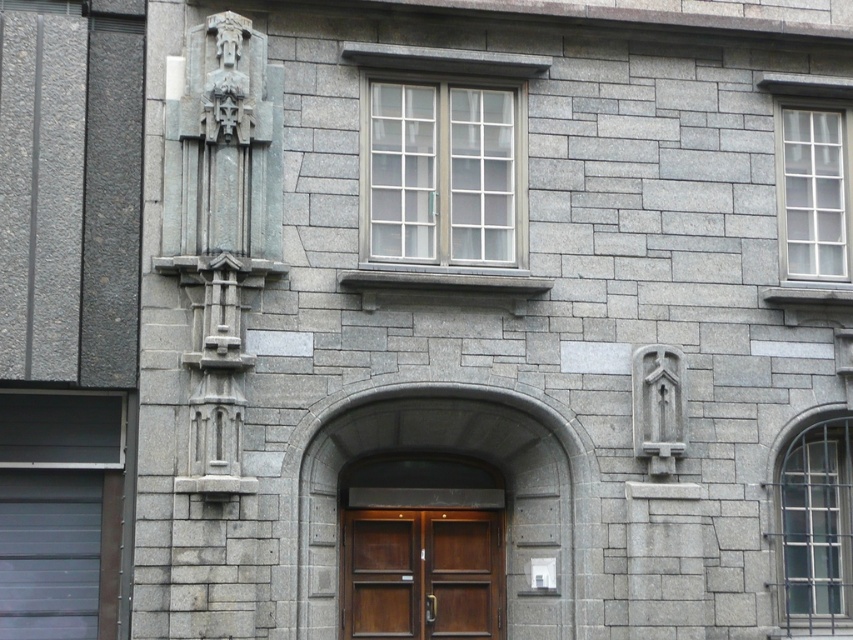
Question: Can you confirm if clear glass window at upper right is positioned below clear glass window at center right?

Choices:
 (A) no
 (B) yes

Answer: (A)

Question: Which of the following is the farthest from the observer?

Choices:
 (A) clear glass window at center
 (B) clear glass window at center right

Answer: (B)

Question: Which point is closer to the camera?

Choices:
 (A) clear glass window at center right
 (B) clear glass window at upper right

Answer: (A)

Question: Which point appears farthest from the camera in this image?

Choices:
 (A) (370, 92)
 (B) (808, 522)

Answer: (B)

Question: Is clear glass window at center further to the viewer compared to clear glass window at upper right?

Choices:
 (A) no
 (B) yes

Answer: (A)

Question: Where is clear glass window at center located in relation to clear glass window at center right in the image?

Choices:
 (A) left
 (B) right

Answer: (A)